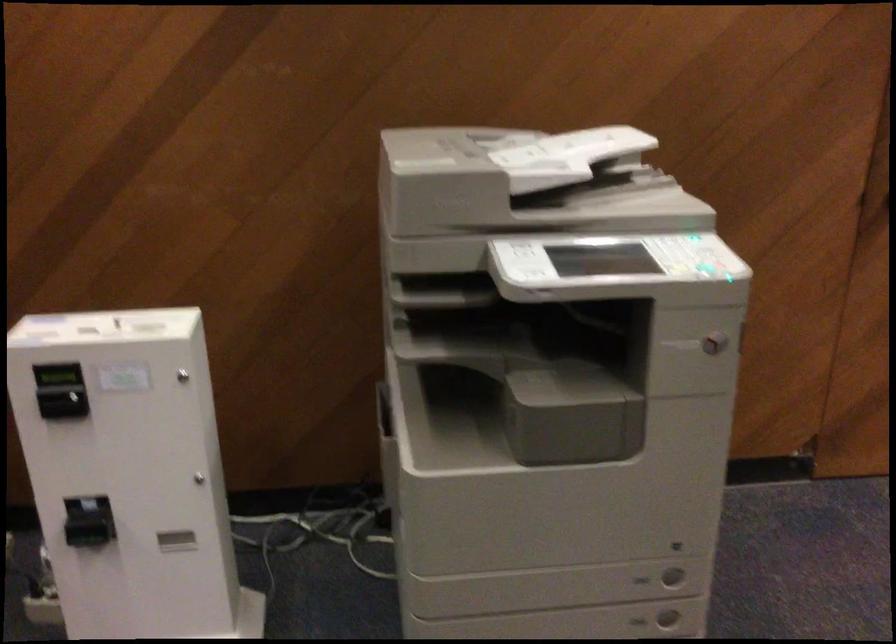
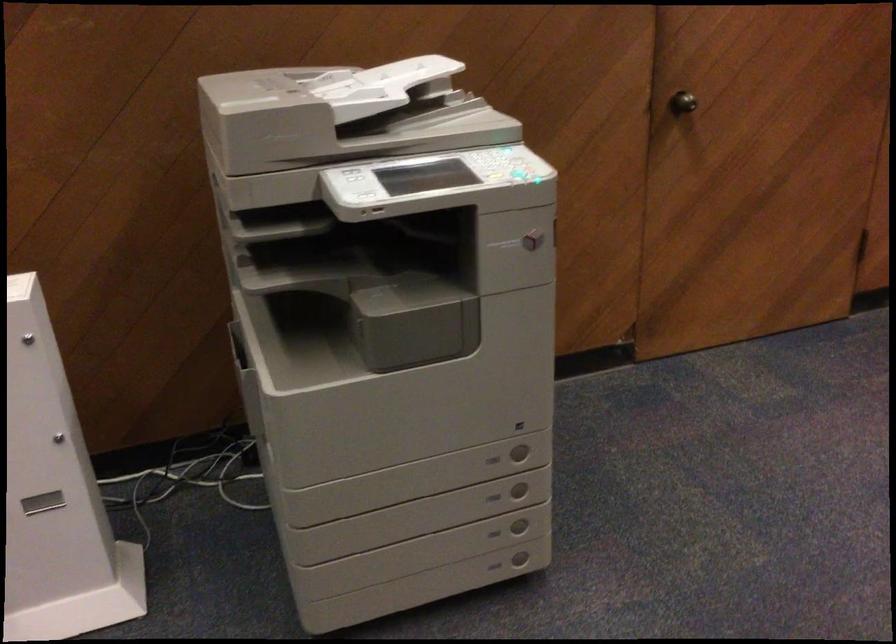
The point at [633,574] is marked in the first image. Where is the corresponding point in the second image?

(492, 459)